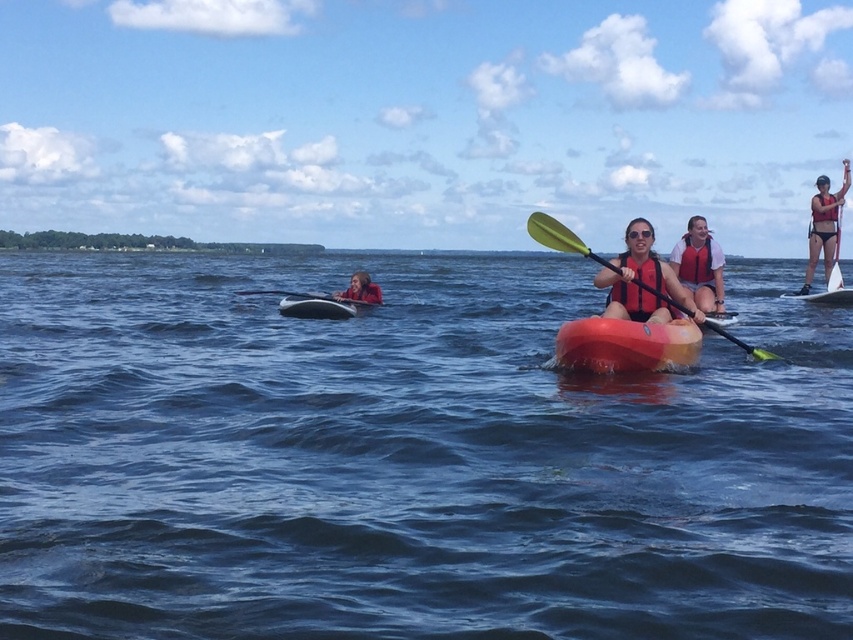
Which is behind, point (676, 326) or point (653, 269)?

Point (653, 269)

Is rubber kayak at center positioned behind orange matte life jacket at center?

No, rubber kayak at center is closer to the viewer.

What do you see at coordinates (625, 344) in the screenshot?
I see `rubber kayak at center` at bounding box center [625, 344].

I want to click on rubber kayak at center, so click(625, 344).

Which of these two, white matte life vest at center or matte red life jacket at upper right, stands taller?

Standing taller between the two is white matte life vest at center.

Which is in front, point (698, 218) or point (821, 214)?

Point (698, 218) is in front.

The image size is (853, 640). What do you see at coordinates (699, 266) in the screenshot? I see `white matte life vest at center` at bounding box center [699, 266].

I want to click on white matte life vest at center, so click(699, 266).

Which is behind, point (345, 301) or point (819, 292)?

Point (819, 292)

Who is positioned more to the left, white glossy canoe at center or white glossy surfboard at right?

From the viewer's perspective, white glossy canoe at center appears more on the left side.

Is point (291, 307) closer to viewer compared to point (822, 301)?

Yes, point (291, 307) is in front of point (822, 301).

Image resolution: width=853 pixels, height=640 pixels. I want to click on white glossy canoe at center, so click(x=315, y=307).